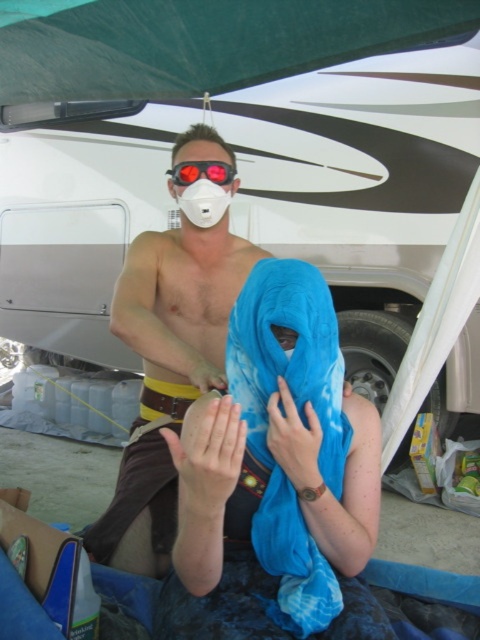
Is green fabric canopy at upper center wider than blue fabric hand at center?

Indeed, green fabric canopy at upper center has a greater width compared to blue fabric hand at center.

Between green fabric canopy at upper center and blue fabric hand at center, which one has more height?

With more height is blue fabric hand at center.

Identify the location of green fabric canopy at upper center. (202, 42).

Identify the location of blue fabric hand at center. (295, 442).

Between point (312, 436) and point (222, 166), which one is positioned in front?

Point (312, 436) is more forward.

Is point (282, 404) closer to viewer compared to point (195, 172)?

Yes, point (282, 404) is in front of point (195, 172).

Locate an element on the screen. blue fabric hand at center is located at coordinates (295, 442).

Is point (235, 90) positioned before point (312, 406)?

No, (235, 90) is further to viewer.

Between white glossy recreational vehicle at upper center and blue silk scarf at center, which one is positioned lower?

Positioned lower is blue silk scarf at center.

Measure the distance between white glossy recreational vehicle at upper center and camera.

white glossy recreational vehicle at upper center is 6.86 feet away from camera.

This screenshot has height=640, width=480. I want to click on white glossy recreational vehicle at upper center, so click(x=253, y=168).